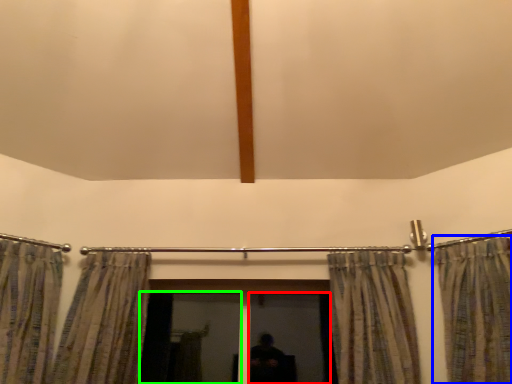
Question: Which object is positioned farthest from screen door (highlighted by a red box)? Select from curtain (highlighted by a blue box) and screen door (highlighted by a green box).

Choices:
 (A) curtain
 (B) screen door

Answer: (A)